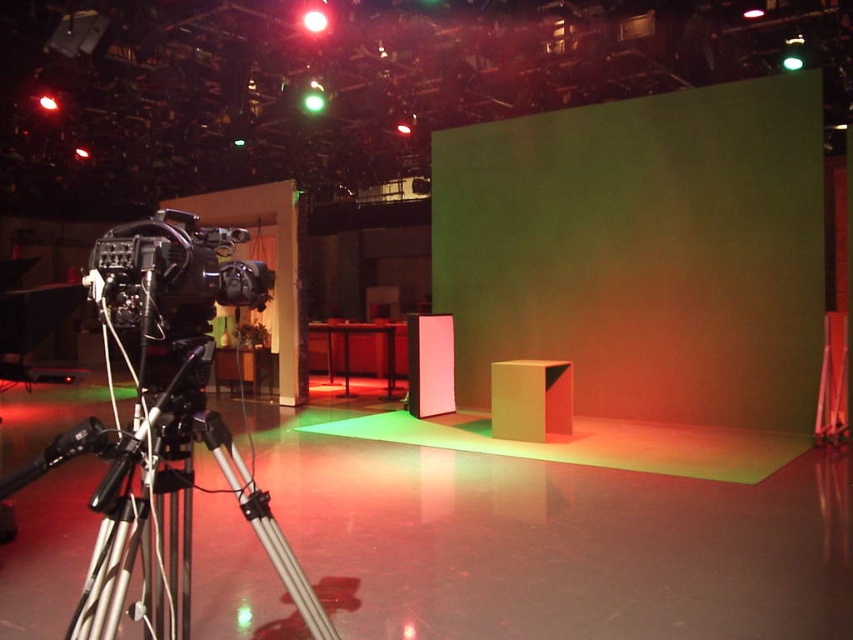
Question: Is green matte projection screen at center bigger than silver metallic tripod at left?

Choices:
 (A) yes
 (B) no

Answer: (A)

Question: Which object appears closest to the camera in this image?

Choices:
 (A) silver metallic tripod at left
 (B) black matte camera at left
 (C) green matte projection screen at center

Answer: (A)

Question: Is green matte projection screen at center thinner than silver metallic tripod at left?

Choices:
 (A) no
 (B) yes

Answer: (A)

Question: Considering the relative positions of silver metallic tripod at left and black matte camera at left in the image provided, where is silver metallic tripod at left located with respect to black matte camera at left?

Choices:
 (A) right
 (B) left

Answer: (B)

Question: Which of the following is the farthest from the observer?

Choices:
 (A) green matte projection screen at center
 (B) silver metallic tripod at left
 (C) black matte camera at left

Answer: (A)

Question: Which point is farther from the camera taking this photo?

Choices:
 (A) (120, 605)
 (B) (131, 285)

Answer: (B)